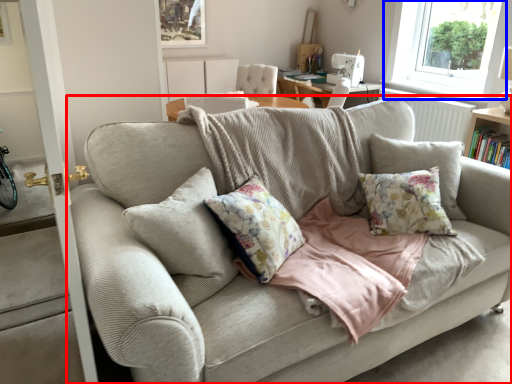
Question: Which point is closer to the camera, studio couch (highlighted by a red box) or window (highlighted by a blue box)?

Choices:
 (A) studio couch
 (B) window

Answer: (A)